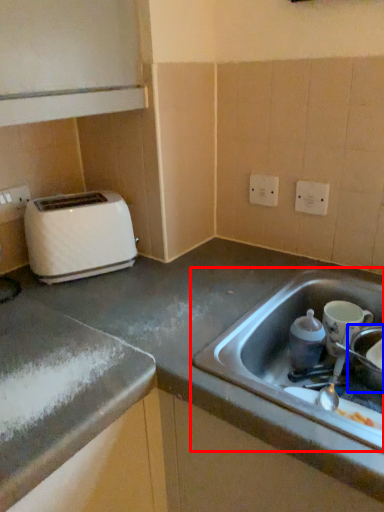
Question: Which point is closer to the camera, sink (highlighted by a red box) or appliance (highlighted by a blue box)?

Choices:
 (A) sink
 (B) appliance

Answer: (A)